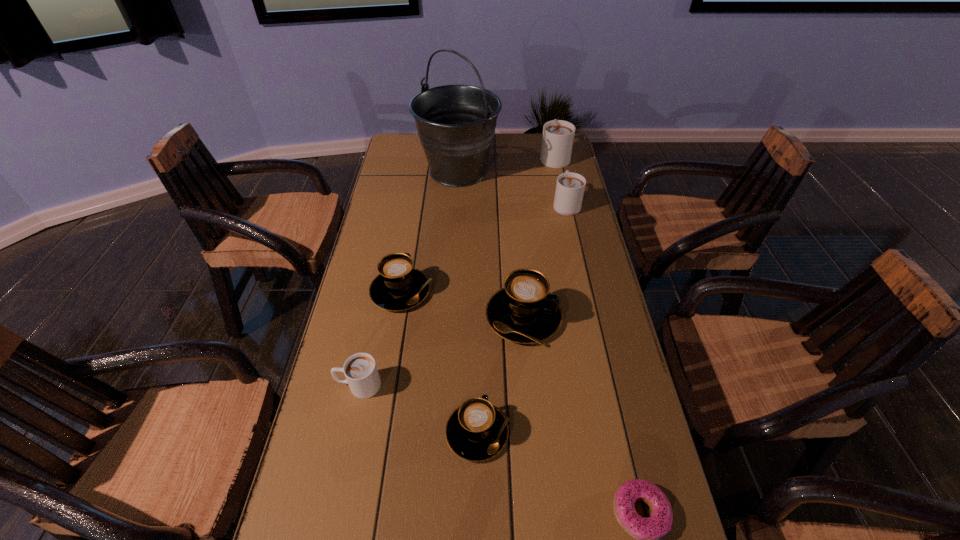
Where is `bucket`? The width and height of the screenshot is (960, 540). bucket is located at coordinates (456, 124).

Find the location of `the tallest object`. the tallest object is located at coordinates (456, 124).

This screenshot has width=960, height=540. I want to click on the farthest cappuccino, so click(558, 135).

At what (x,y) coordinates should I click in order to perform the action: click on the biggest white cappuccino. Please return your answer as a coordinate pair (x, y). The image size is (960, 540). Looking at the image, I should click on point(558,135).

Find the location of a particular element. The image size is (960, 540). the biggest black cappuccino is located at coordinates (524, 311).

This screenshot has width=960, height=540. What are the coordinates of `the second biggest white cappuccino` in the screenshot? It's located at (570, 187).

The height and width of the screenshot is (540, 960). I want to click on the second nearest white cappuccino, so click(570, 187).

Locate an element on the screen. the leftmost black cappuccino is located at coordinates (399, 286).

Locate an element on the screen. The image size is (960, 540). the third nearest object is located at coordinates (360, 370).

In order to click on the leftmost white cappuccino in this screenshot , I will do `click(360, 370)`.